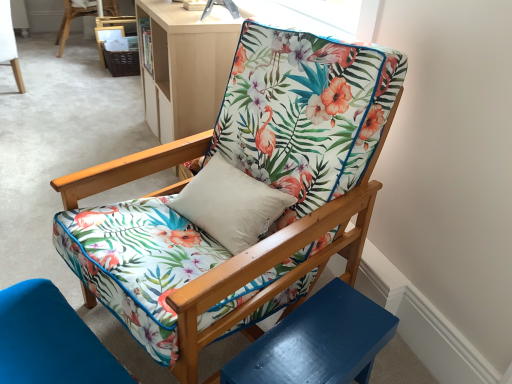
Locate an element on the screen. The image size is (512, 384). free point above floral fabric cushion at lower left, the second chair when ordered from front to back (from a real-world perspective) is located at coordinates (44, 331).